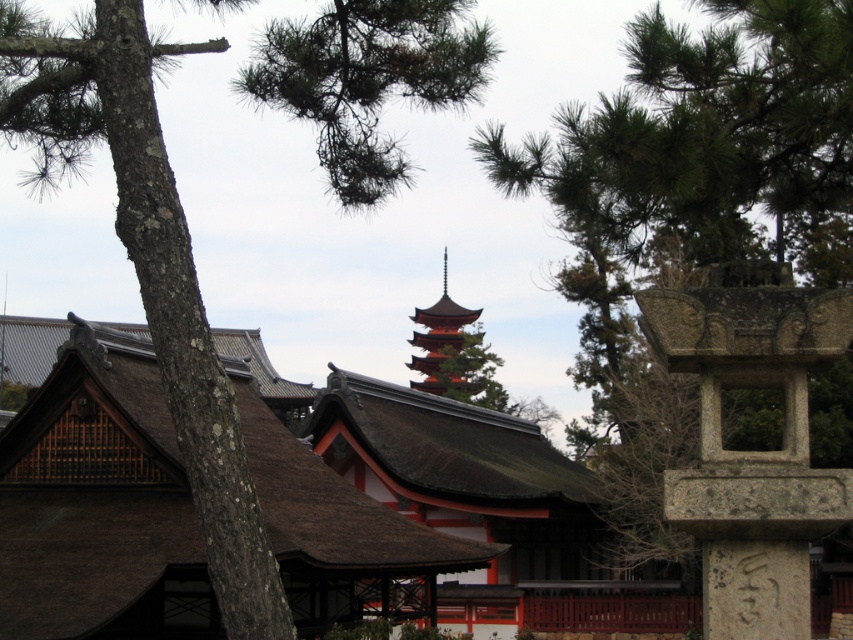
Question: Does brown lichen-covered tree at upper left appear over red lacquered pagoda at center?

Choices:
 (A) yes
 (B) no

Answer: (A)

Question: Which point is farther to the camera?

Choices:
 (A) (732, 269)
 (B) (122, 77)

Answer: (B)

Question: Which point appears farthest from the camera in this image?

Choices:
 (A) (45, 184)
 (B) (479, 312)
 (C) (793, 416)

Answer: (B)

Question: Does brown lichen-covered tree at upper left appear on the right side of gray stone lantern at right?

Choices:
 (A) yes
 (B) no

Answer: (B)

Question: Is brown lichen-covered tree at upper left to the right of red lacquered pagoda at center from the viewer's perspective?

Choices:
 (A) no
 (B) yes

Answer: (A)

Question: Which object is positioned closest to the red lacquered pagoda at center?

Choices:
 (A) gray stone lantern at right
 (B) brown lichen-covered tree at upper left

Answer: (B)